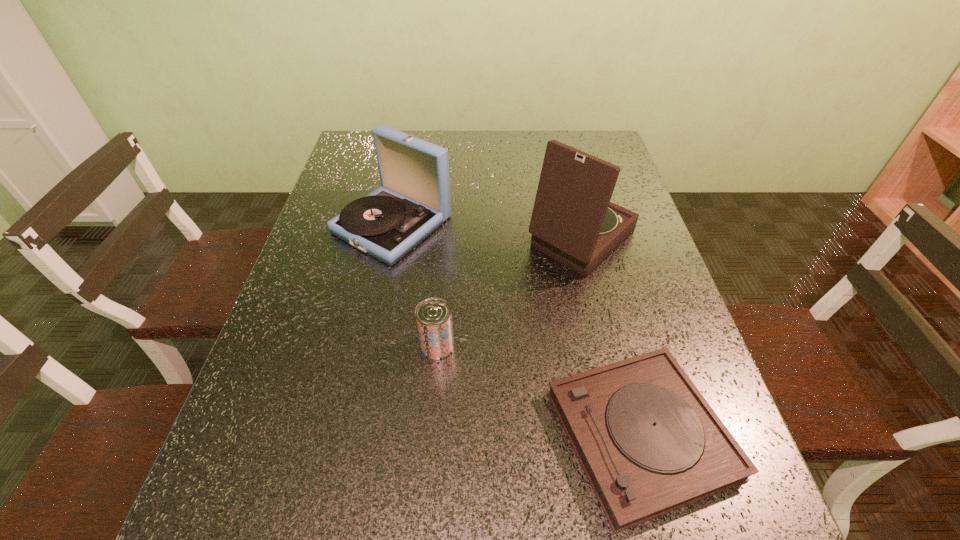
The width and height of the screenshot is (960, 540). In order to click on the tallest object in this screenshot , I will do pyautogui.click(x=573, y=221).

This screenshot has width=960, height=540. In order to click on the second shortest phonograph record in this screenshot , I will do `click(414, 200)`.

At what (x,y) coordinates should I click in order to perform the action: click on the third shortest object. Please return your answer as a coordinate pair (x, y). The width and height of the screenshot is (960, 540). Looking at the image, I should click on (414, 200).

Where is `the third tallest object`? the third tallest object is located at coordinates (433, 316).

Find the location of a particular element. the shortest phonograph record is located at coordinates (649, 443).

What are the coordinates of `the nearest phonograph record` in the screenshot? It's located at (649, 443).

Locate an element on the screen. The width and height of the screenshot is (960, 540). free space located on the left of the tallest object is located at coordinates (490, 239).

What are the coordinates of `vacant space located 0.170m on the back of the second tallest object` in the screenshot? It's located at (407, 159).

Find the location of `vacant space situated 0.380m on the right of the third tallest object`. vacant space situated 0.380m on the right of the third tallest object is located at coordinates coord(642,345).

At what (x,y) coordinates should I click in order to perform the action: click on free point located 0.330m on the back of the shortest object. Please return your answer as a coordinate pair (x, y). Looking at the image, I should click on (591, 247).